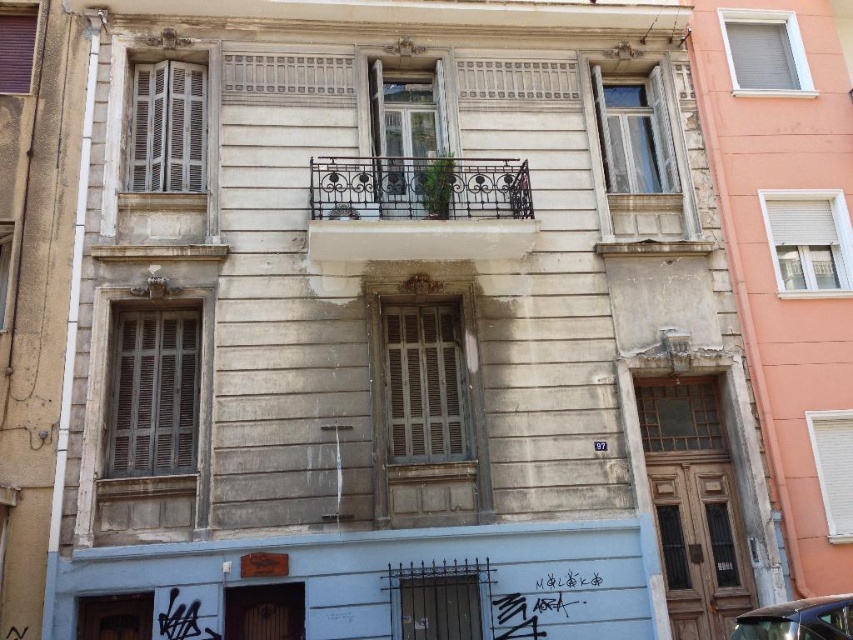
Question: Is black wrought iron balcony at center to the right of shiny black car at lower right from the viewer's perspective?

Choices:
 (A) yes
 (B) no

Answer: (B)

Question: Can you confirm if black wrought iron balcony at center is positioned to the left of shiny black car at lower right?

Choices:
 (A) no
 (B) yes

Answer: (B)

Question: Is black wrought iron balcony at center positioned at the back of shiny black car at lower right?

Choices:
 (A) yes
 (B) no

Answer: (A)

Question: Which point is farther to the camera?

Choices:
 (A) (772, 637)
 (B) (447, 220)

Answer: (B)